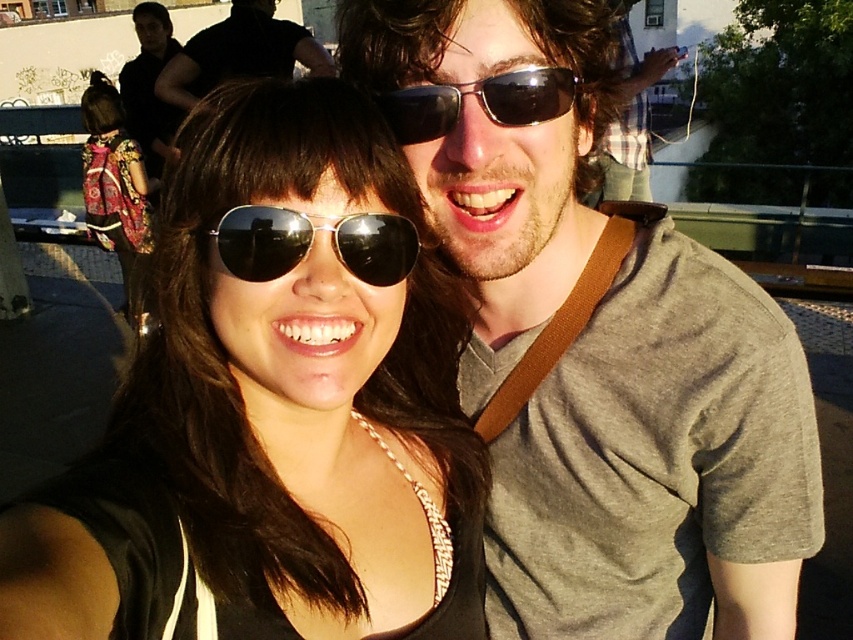
You are a photographer trying to capture a closeup of the matte black sunglasses at center. Based on their position coordinates, where should you aim your camera?

The matte black sunglasses at center are located at coordinates point (273, 406), so aim your camera at that position to capture the closeup.

You are a photographer trying to capture a candid shot of the two people in the scene. You notice the aviator sunglasses at center and the patterned fabric dress at left. Which object is positioned lower in the image?

The aviator sunglasses at center is located below the patterned fabric dress at left, so the aviator sunglasses at center is positioned lower in the image.

You are a photographer setting up for a group photo. You notice the aviator sunglasses at center and the patterned fabric dress at left in the scene. Which object is closer to the camera based on their sizes?

The aviator sunglasses at center is shorter than the patterned fabric dress at left, so the sunglasses are closer to the camera since objects closer appear smaller.